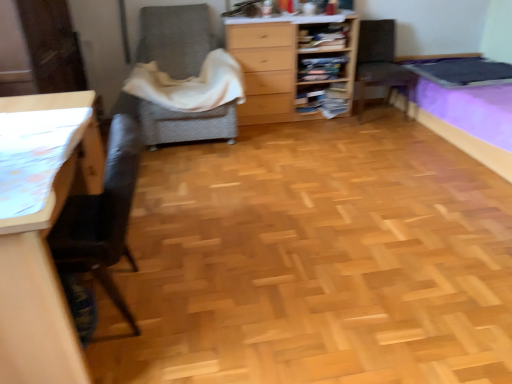
Question: From a real-world perspective, is textured gray armchair at center, placed as the first chair when sorted from left to right, positioned above or below white soft blanket at center?

Choices:
 (A) below
 (B) above

Answer: (A)

Question: Considering the positions of textured gray armchair at center, placed as the first chair when sorted from left to right, and white soft blanket at center in the image, is textured gray armchair at center, placed as the first chair when sorted from left to right, wider or thinner than white soft blanket at center?

Choices:
 (A) wide
 (B) thin

Answer: (A)

Question: Which of these objects is positioned farthest from the wooden bookshelf at upper center, the 1th shelf positioned from the top?

Choices:
 (A) brown fabric chair at upper right, the 2th chair viewed from the left
 (B) white soft blanket at center
 (C) wooden chest of drawers at center
 (D) light brown wood desk at left
 (E) wooden bookshelf at center, placed as the 2th shelf when sorted from bottom to top

Answer: (D)

Question: Estimate the real-world distances between objects in this image. Which object is closer to the wooden bookshelf at upper center, the 1th shelf positioned from the top?

Choices:
 (A) light brown wood desk at left
 (B) white soft blanket at center
 (C) brown fabric chair at upper right, the 2th chair viewed from the left
 (D) textured gray armchair at center, which is the second chair in right-to-left order
 (E) wooden chest of drawers at center

Answer: (E)